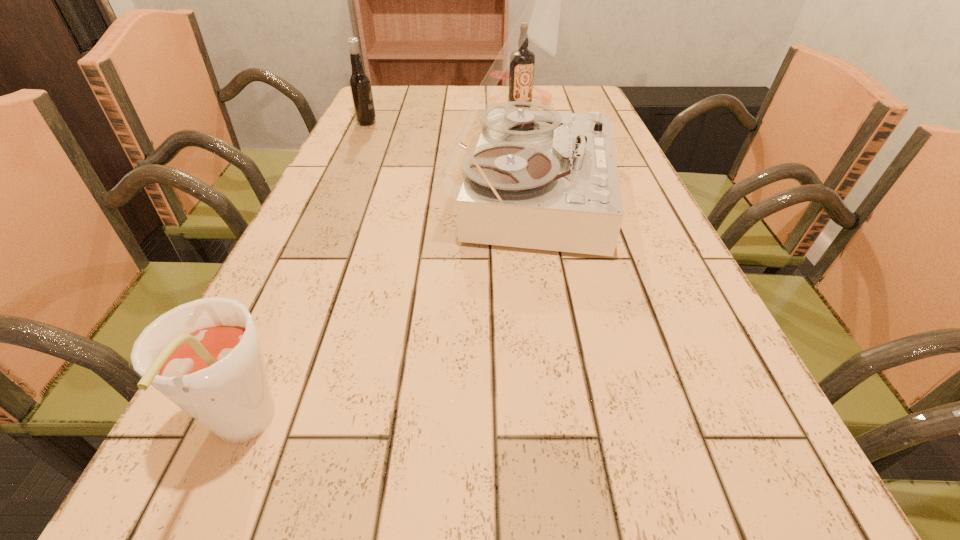
The height and width of the screenshot is (540, 960). In order to click on vacant region that satisfies the following two spatial constraints: 1. on the label of the second farthest root beer; 2. on the left side of the second nearest object in this screenshot , I will do `click(334, 193)`.